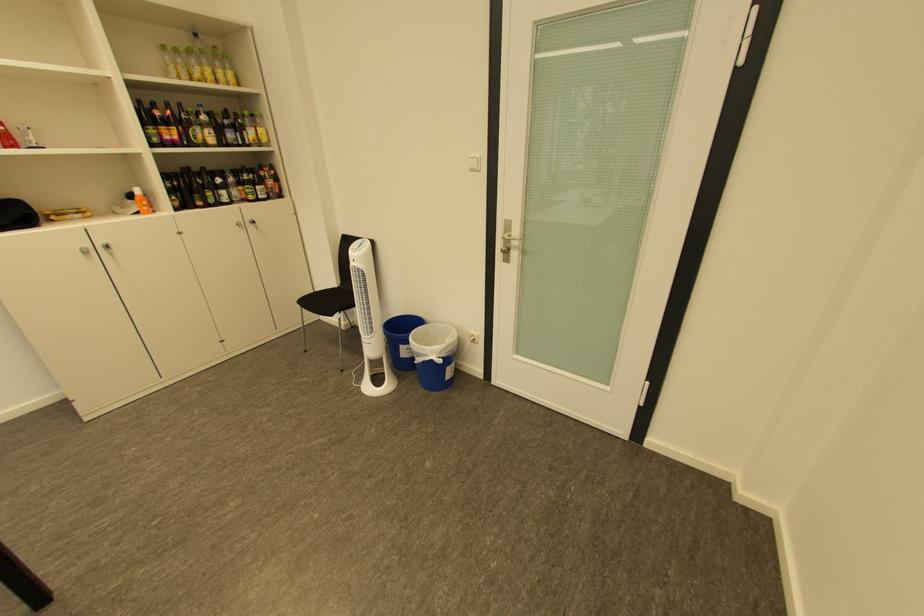
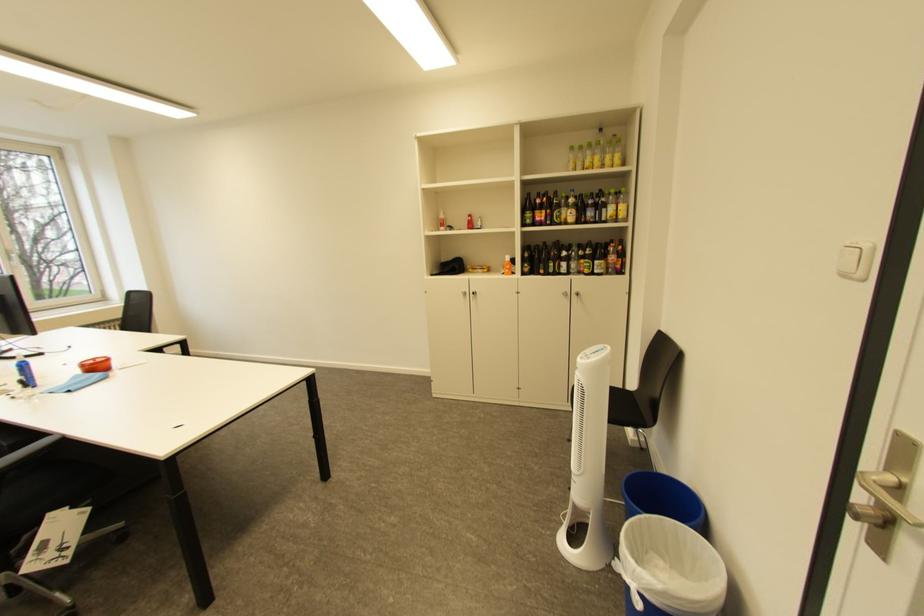
Locate, in the second image, the point that corresponds to (363,253) in the first image.

(591, 359)